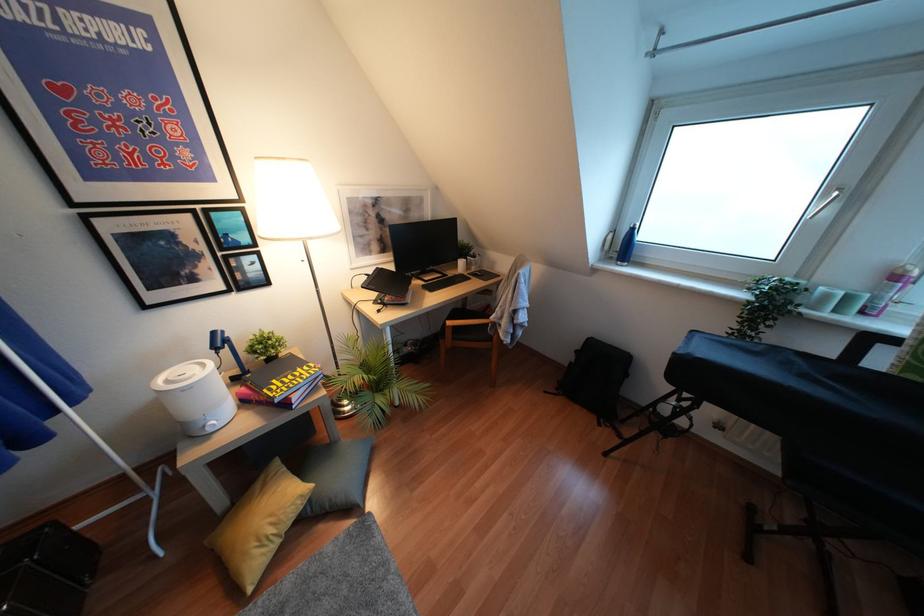
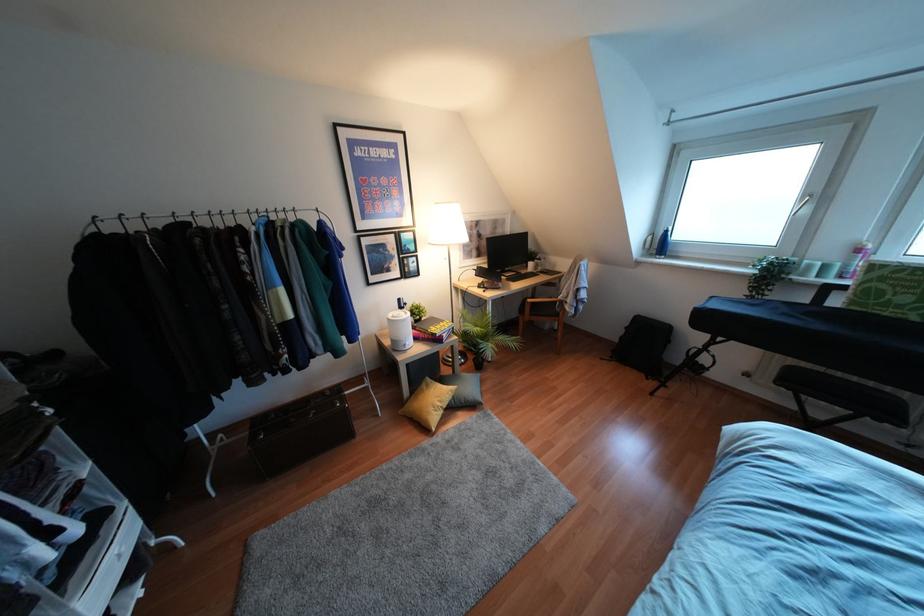
Find the pixel in the second image that matches pixel 271 530 in the first image.

(439, 403)